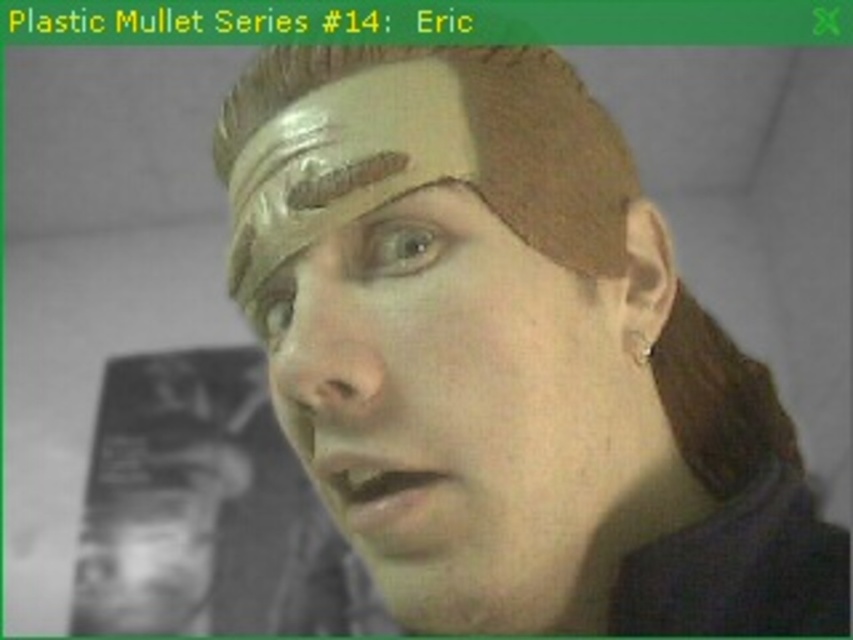
Measure the distance from matte plastic face at center to brown matte eye at center.

matte plastic face at center and brown matte eye at center are 2.53 inches apart from each other.

Consider the image. Does matte plastic face at center have a greater height compared to brown matte eye at center?

Yes, matte plastic face at center is taller than brown matte eye at center.

Is point (534, 308) closer to camera compared to point (393, 228)?

Yes, it is.

This screenshot has width=853, height=640. I want to click on matte plastic face at center, so click(466, 420).

Between light brown matte eye at center and matte gold eyebrow at upper center, which one is positioned higher?

matte gold eyebrow at upper center

Does light brown matte eye at center appear under matte gold eyebrow at upper center?

Indeed, light brown matte eye at center is positioned under matte gold eyebrow at upper center.

Which is in front, point (286, 316) or point (393, 198)?

Positioned in front is point (393, 198).

Where is `light brown matte eye at center`? The width and height of the screenshot is (853, 640). light brown matte eye at center is located at coordinates (273, 308).

Which of these two, matte plastic headband at center or smooth plastic head at lower left, stands shorter?

matte plastic headband at center is shorter.

Between point (314, 426) and point (242, 486), which one is positioned behind?

Positioned behind is point (242, 486).

Find the location of `matte plastic headband at center`. matte plastic headband at center is located at coordinates (511, 356).